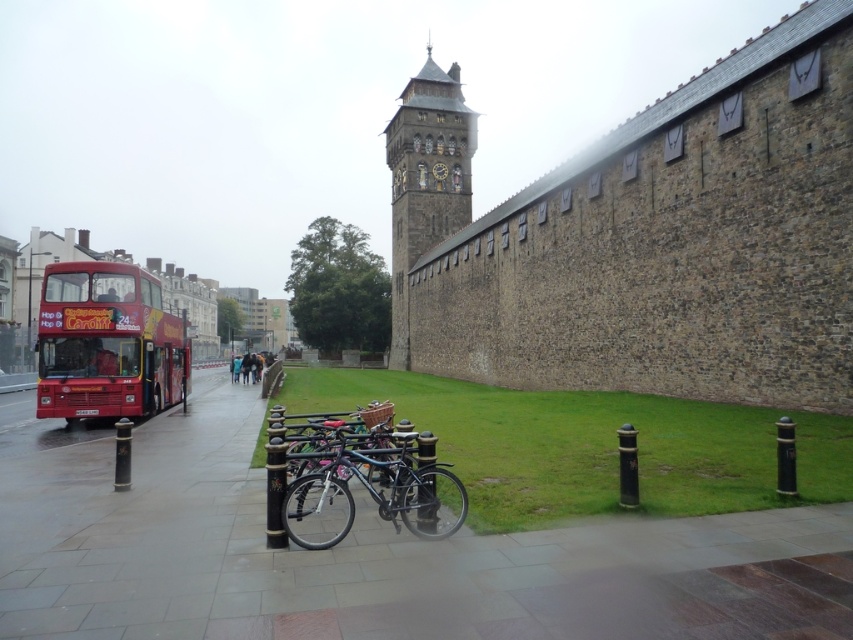
You are standing in front of the historic stone wall and notice two points marked on the wall. The first point is at coordinates point (704, 532) and the second is at point (341, 470). Which point is closer to you?

Point (704, 532) is closer to the camera than point (341, 470).

You are a delivery robot navigating through an urban area. You need to move from the historic stone wall on the right to the smooth concrete pavement at center. What is the shortest path you can take?

The shortest path would be to move directly towards the smooth concrete pavement at center located at point coordinates (369, 554). Since there are no obstacles mentioned between the historic stone wall on the right and the smooth concrete pavement at center, the most efficient route is a straight line towards the coordinates provided.